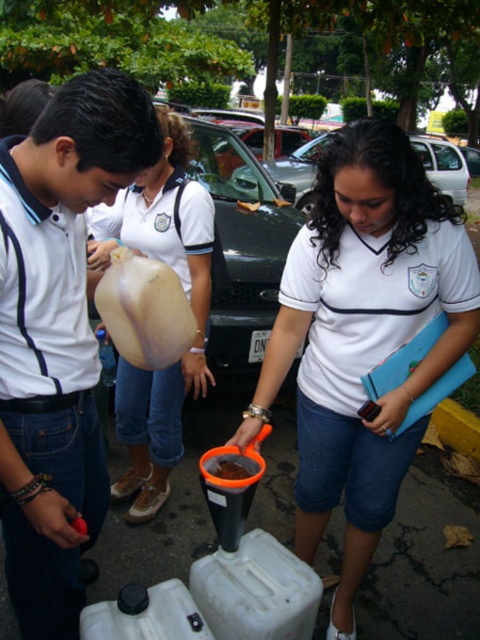
Question: Which point is closer to the camera taking this photo?

Choices:
 (A) (225, 467)
 (B) (108, 220)
 (C) (466, 188)
 (D) (142, 262)

Answer: (D)

Question: Is white matte shirt at center to the left of metallic silver car at center from the viewer's perspective?

Choices:
 (A) no
 (B) yes

Answer: (B)

Question: Which object is closer to the camera taking this photo?

Choices:
 (A) white matte shirt at center
 (B) translucent rubber balloon at center
 (C) orange matte plastic bucket at center

Answer: (B)

Question: Is white matte shirt at center behind metallic silver car at center?

Choices:
 (A) no
 (B) yes

Answer: (A)

Question: Which object is the farthest from the matte white balloon at left?

Choices:
 (A) metallic silver car at center
 (B) orange matte plastic bucket at center
 (C) matte white balloon at center

Answer: (A)

Question: Can you confirm if matte white balloon at center is positioned above orange matte plastic bucket at center?

Choices:
 (A) yes
 (B) no

Answer: (A)